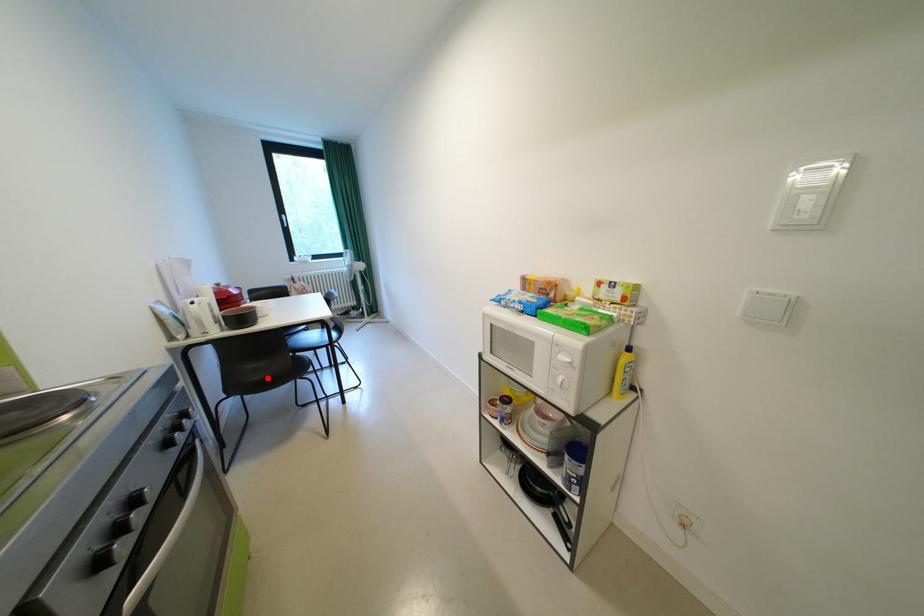
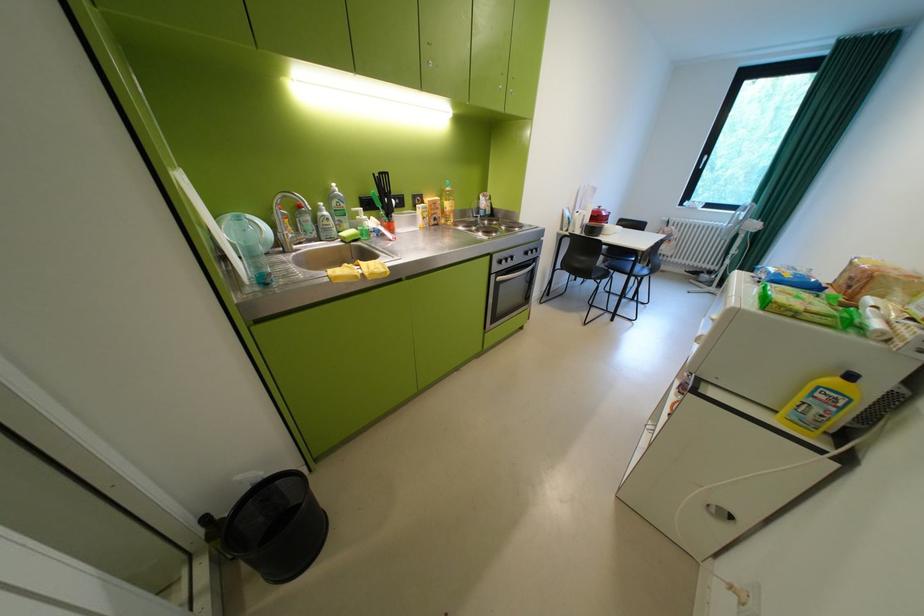
The point at the highlighted location is marked in the first image. Where is the corresponding point in the second image?

(587, 265)